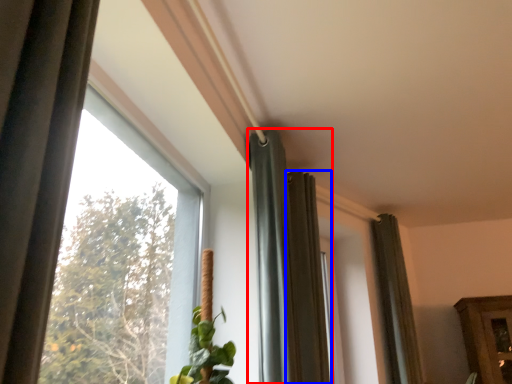
Question: Among these objects, which one is farthest to the camera, curtain (highlighted by a red box) or curtain (highlighted by a blue box)?

Choices:
 (A) curtain
 (B) curtain

Answer: (B)